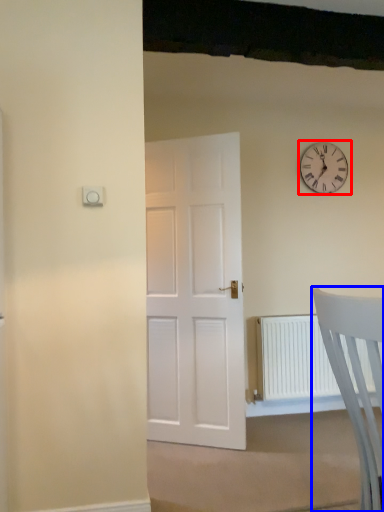
Question: Which point is closer to the camera, wall clock (highlighted by a red box) or chair (highlighted by a blue box)?

Choices:
 (A) wall clock
 (B) chair

Answer: (B)